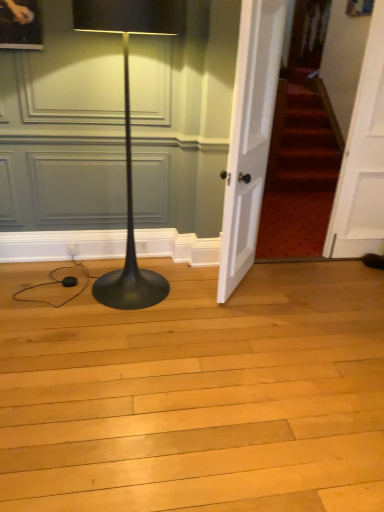
At what (x,y) coordinates should I click in order to perform the action: click on free location in front of black glossy floor lamp at left. Please return your answer as a coordinate pair (x, y). This screenshot has height=512, width=384. Looking at the image, I should click on (132, 335).